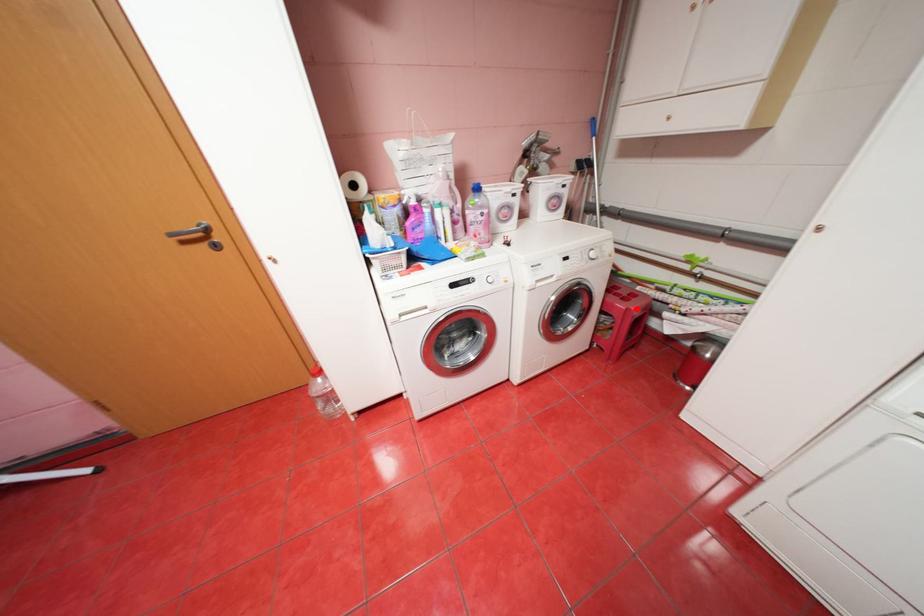
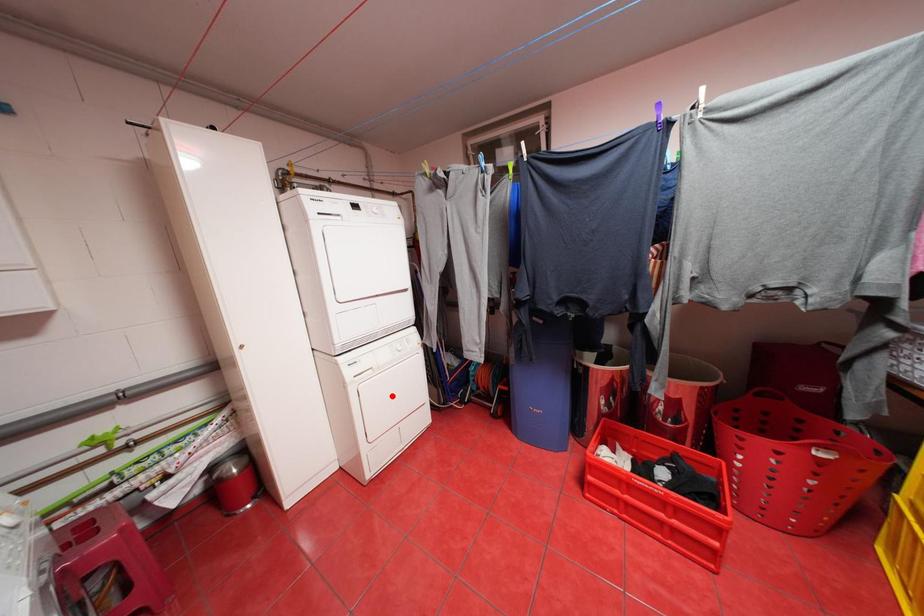
I am providing you with two images of the same scene from different viewpoints. A red point is marked on the first image and another point is marked on the second image. Are the points marked in image1 and image2 representing the same 3D position?

No